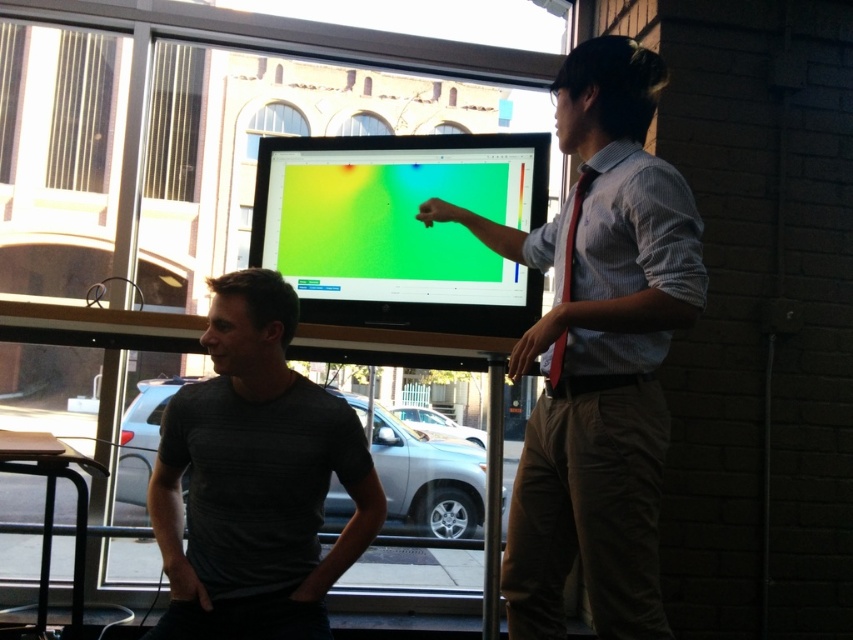
Question: Which point is closer to the camera?

Choices:
 (A) gray textured shirt at center
 (B) light brown cotton shirt at center
 (C) matte plastic monitor at center

Answer: (B)

Question: Is gray textured shirt at center to the left of matte plastic monitor at center from the viewer's perspective?

Choices:
 (A) yes
 (B) no

Answer: (A)

Question: Is gray textured shirt at center positioned behind matte plastic monitor at center?

Choices:
 (A) yes
 (B) no

Answer: (B)

Question: Among these points, which one is farthest from the camera?

Choices:
 (A) (317, 224)
 (B) (564, 92)

Answer: (A)

Question: Which of the following is the closest to the observer?

Choices:
 (A) gray textured shirt at center
 (B) matte plastic monitor at center

Answer: (A)

Question: From the image, what is the correct spatial relationship of gray textured shirt at center in relation to matte plastic monitor at center?

Choices:
 (A) above
 (B) below

Answer: (B)